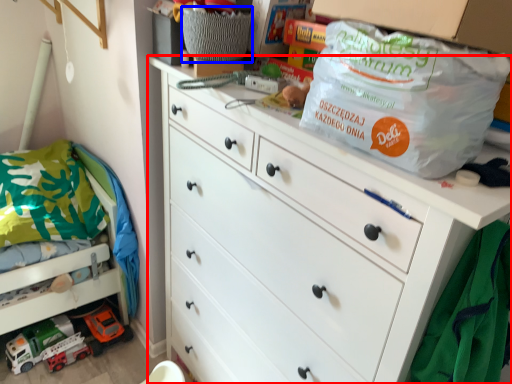
Question: Which of the following is the farthest to the observer, chest of drawers (highlighted by a red box) or basket (highlighted by a blue box)?

Choices:
 (A) chest of drawers
 (B) basket

Answer: (B)